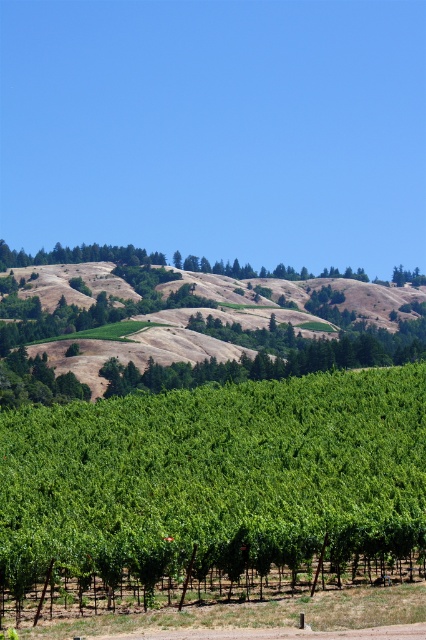
Question: Which point is closer to the camera taking this photo?

Choices:
 (A) (143, 444)
 (B) (94, 353)

Answer: (A)

Question: Can you confirm if green leafy tree at center is smaller than brown textured hillside at upper center?

Choices:
 (A) no
 (B) yes

Answer: (B)

Question: Which point is closer to the camera?

Choices:
 (A) green leafy tree at center
 (B) brown textured hillside at upper center

Answer: (A)

Question: Is green leafy tree at center positioned behind brown textured hillside at upper center?

Choices:
 (A) no
 (B) yes

Answer: (A)

Question: Does green leafy tree at center appear on the right side of brown textured hillside at upper center?

Choices:
 (A) yes
 (B) no

Answer: (B)

Question: Which point appears farthest from the camera in this image?

Choices:
 (A) (5, 442)
 (B) (135, 310)

Answer: (B)